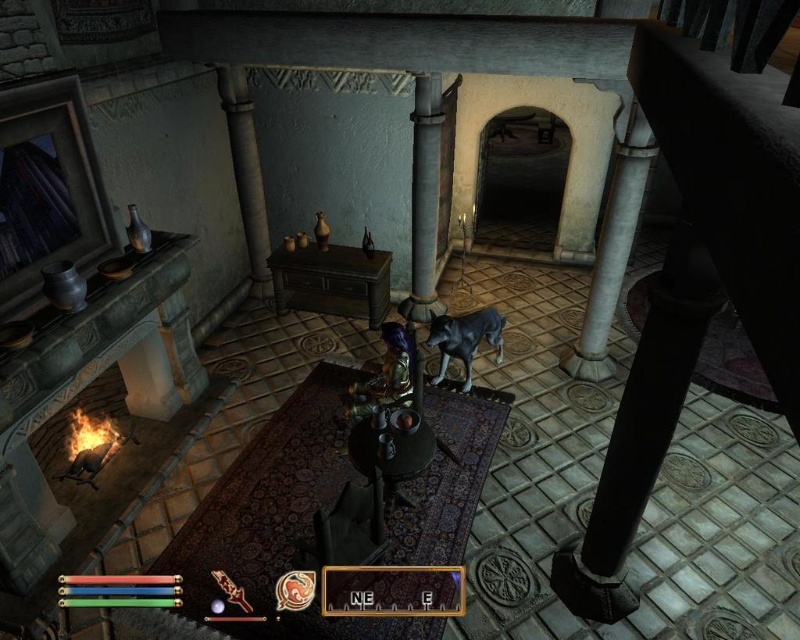
From the picture: Which is above, black polished wood pillar at right or gray stone pillar at center?

gray stone pillar at center is higher up.

Does black polished wood pillar at right have a greater width compared to gray stone pillar at center?

Correct, the width of black polished wood pillar at right exceeds that of gray stone pillar at center.

Locate an element on the screen. This screenshot has width=800, height=640. black polished wood pillar at right is located at coordinates (641, 428).

Where is `black polished wood pillar at right`? The image size is (800, 640). black polished wood pillar at right is located at coordinates (641, 428).

Between point (592, 358) and point (232, 124), which one is positioned in front?

Positioned in front is point (592, 358).

Does point (632, 156) lie in front of point (252, 292)?

Yes, point (632, 156) is closer to viewer.

Which is behind, point (598, 371) or point (225, 104)?

The point (225, 104) is more distant.

At what (x,y) coordinates should I click in order to perform the action: click on white marble pillar at right. Please return your answer as a coordinate pair (x, y). Looking at the image, I should click on (612, 252).

Is black polished wood pillar at right wider than white marble pillar at right?

Correct, the width of black polished wood pillar at right exceeds that of white marble pillar at right.

Who is more distant from viewer, (600, 483) or (605, 205)?

The point (605, 205) is more distant.

Who is more distant from viewer, (617, 548) or (632, 186)?

The point (632, 186) is behind.

This screenshot has width=800, height=640. In order to click on black polished wood pillar at right in this screenshot , I will do (x=641, y=428).